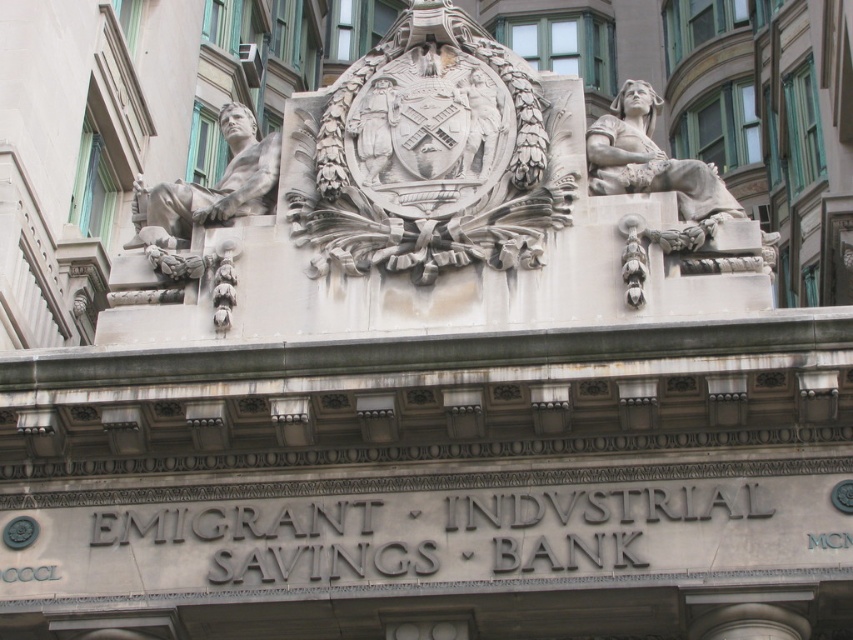
Question: From the image, what is the correct spatial relationship of matte gray stone statue at left in relation to white stone statue at upper right?

Choices:
 (A) below
 (B) above

Answer: (A)

Question: Can you confirm if matte gray stone statue at left is smaller than white stone statue at upper right?

Choices:
 (A) no
 (B) yes

Answer: (B)

Question: Among these points, which one is farthest from the camera?

Choices:
 (A) (175, 220)
 (B) (720, 189)

Answer: (A)

Question: Can you confirm if matte gray stone statue at left is positioned to the right of white stone statue at upper right?

Choices:
 (A) no
 (B) yes

Answer: (A)